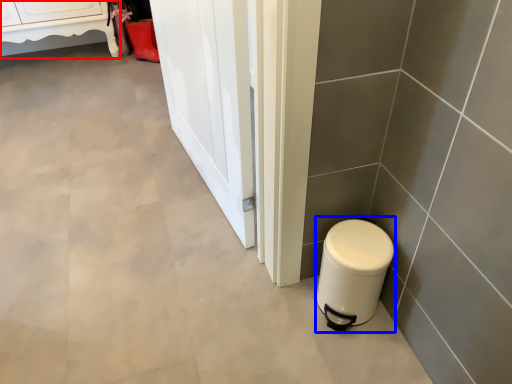
Question: Among these objects, which one is nearest to the camera, furniture (highlighted by a red box) or appliance (highlighted by a blue box)?

Choices:
 (A) furniture
 (B) appliance

Answer: (B)